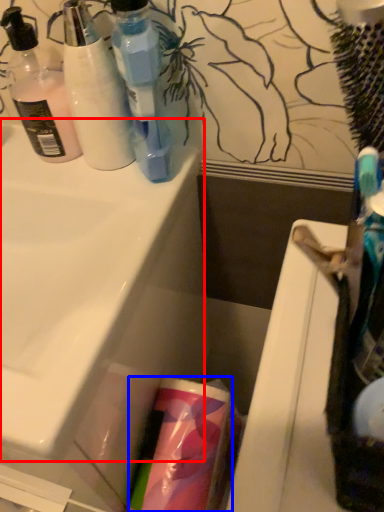
Question: Which object appears farthest to the camera in this image, sink (highlighted by a red box) or cleaning product (highlighted by a blue box)?

Choices:
 (A) sink
 (B) cleaning product

Answer: (B)